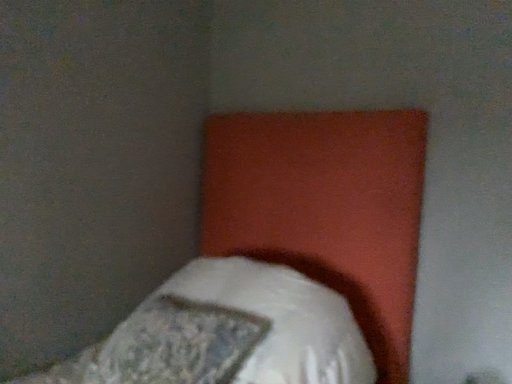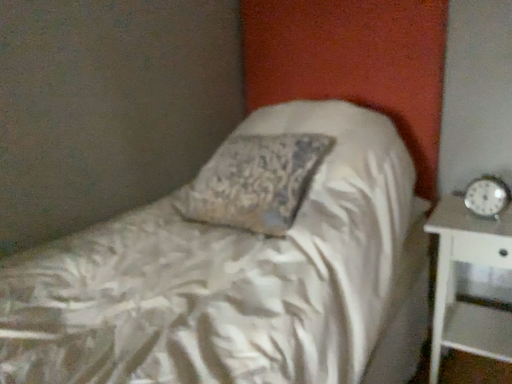
Question: How did the camera likely rotate when shooting the video?

Choices:
 (A) rotated upward
 (B) rotated downward

Answer: (B)